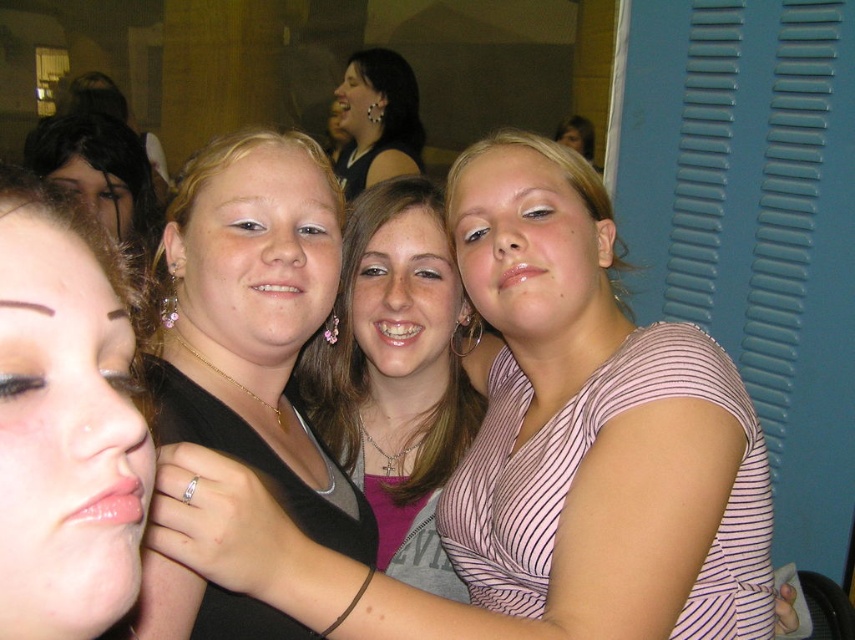
Question: Which object is closer to the camera taking this photo?

Choices:
 (A) matte black hair at left
 (B) pink striped shirt at center
 (C) matte black top at upper center

Answer: (A)

Question: Is pink striped shirt at center behind matte black hair at left?

Choices:
 (A) yes
 (B) no

Answer: (A)

Question: Among these points, which one is farthest from the camera?

Choices:
 (A) (366, 102)
 (B) (28, 397)
 (C) (276, 547)

Answer: (A)

Question: Can you confirm if pink striped shirt at center is positioned above matte black top at upper center?

Choices:
 (A) yes
 (B) no

Answer: (B)

Question: Which of these objects is positioned closest to the matte black hair at left?

Choices:
 (A) matte black top at upper center
 (B) pink striped shirt at center

Answer: (B)

Question: Is pink striped shirt at center thinner than matte black top at upper center?

Choices:
 (A) no
 (B) yes

Answer: (A)